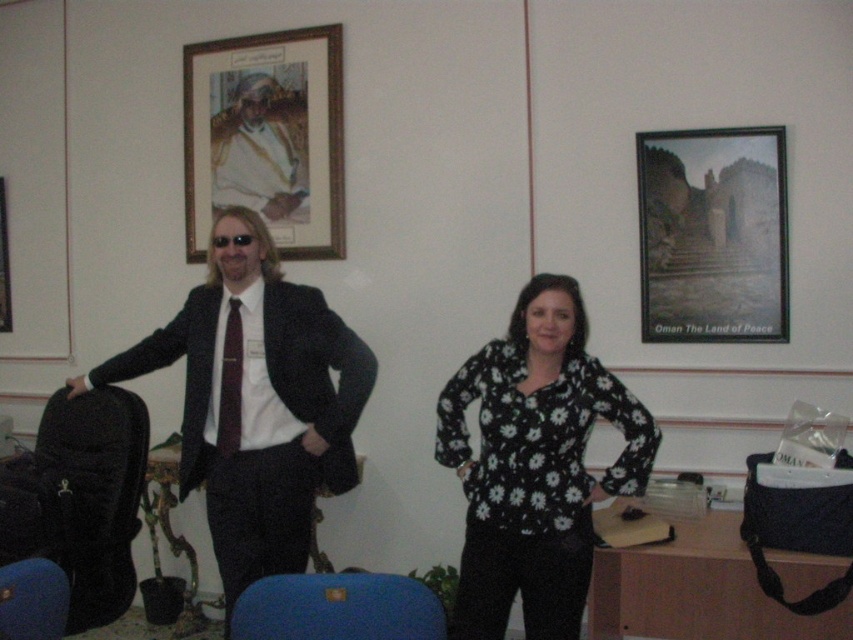
You are an interior designer working on a layout for an office. You need to place a new desk in the room such that it is exactly at the point specified by the coordinates provided. What object is located at the coordinates point [260,148]?

The point [260,148] corresponds to the white satin suit at center.

You are standing in the office and need to locate the matte black suit at center. According to the coordinates provided, where should you look to find it?

The matte black suit at center is located at coordinates point (257, 404).